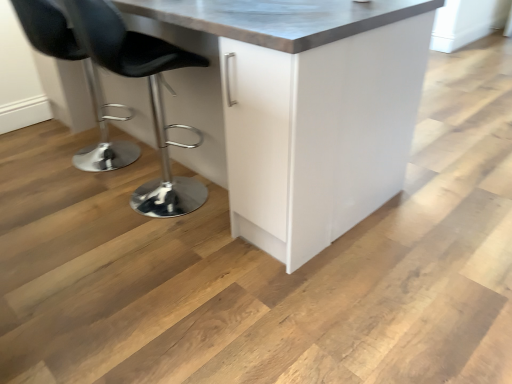
Where is `black leather stool at left, arranged as the first chair when viewed from the right`? The height and width of the screenshot is (384, 512). black leather stool at left, arranged as the first chair when viewed from the right is located at coordinates (149, 95).

This screenshot has height=384, width=512. I want to click on black leather stool at left, arranged as the first chair when viewed from the right, so click(x=149, y=95).

Can we say black leather stool at left, arranged as the first chair when viewed from the right, lies outside white glossy cabinet at center?

No, black leather stool at left, arranged as the first chair when viewed from the right, is inside or overlapping with white glossy cabinet at center.

Is black leather stool at left, arranged as the first chair when viewed from the right, looking in the opposite direction of white glossy cabinet at center?

Absolutely, black leather stool at left, arranged as the first chair when viewed from the right, is directed away from white glossy cabinet at center.

From the image's perspective, is black leather stool at left, arranged as the 2th chair when viewed from the left, positioned above or below white glossy cabinet at center?

Clearly, from the image's perspective, black leather stool at left, arranged as the 2th chair when viewed from the left, is below white glossy cabinet at center.

Image resolution: width=512 pixels, height=384 pixels. I want to click on cabinetry that appears below the black leather stool at left, arranged as the first chair when viewed from the right (from a real-world perspective), so click(x=311, y=108).

Is black leather stool at left, arranged as the first chair when viewed from the right, outside of black leather stool at left, the first chair in the left-to-right sequence?

That's correct, black leather stool at left, arranged as the first chair when viewed from the right, is outside of black leather stool at left, the first chair in the left-to-right sequence.

Can you confirm if black leather stool at left, arranged as the 2th chair when viewed from the left, is smaller than black leather stool at left, the first chair in the left-to-right sequence?

No, black leather stool at left, arranged as the 2th chair when viewed from the left, is not smaller than black leather stool at left, the first chair in the left-to-right sequence.

Relative to black leather stool at left, the first chair in the left-to-right sequence, is black leather stool at left, arranged as the first chair when viewed from the right, in front or behind?

black leather stool at left, arranged as the first chair when viewed from the right, is in front of black leather stool at left, the first chair in the left-to-right sequence.

Based on their positions, is black leather stool at left, arranged as the 2th chair when viewed from the left, located to the left or right of black leather stool at left, the second chair viewed from the right?

From the image, it's evident that black leather stool at left, arranged as the 2th chair when viewed from the left, is to the right of black leather stool at left, the second chair viewed from the right.

Between point (342, 36) and point (24, 29), which one is positioned in front?

The point (342, 36) is closer to the camera.

Which is more to the right, white glossy cabinet at center or black leather stool at left, the first chair in the left-to-right sequence?

white glossy cabinet at center.

From the image's perspective, which object appears higher, white glossy cabinet at center or black leather stool at left, the second chair viewed from the right?

From the image's view, white glossy cabinet at center is above.

Is black leather stool at left, the first chair in the left-to-right sequence, wider or thinner than black leather stool at left, arranged as the 2th chair when viewed from the left?

Clearly, black leather stool at left, the first chair in the left-to-right sequence, has less width compared to black leather stool at left, arranged as the 2th chair when viewed from the left.

Considering the relative positions of black leather stool at left, the first chair in the left-to-right sequence, and black leather stool at left, arranged as the 2th chair when viewed from the left, in the image provided, is black leather stool at left, the first chair in the left-to-right sequence, to the left or to the right of black leather stool at left, arranged as the 2th chair when viewed from the left,?

black leather stool at left, the first chair in the left-to-right sequence, is positioned on black leather stool at left, arranged as the 2th chair when viewed from the left,'s left side.

Is black leather stool at left, the second chair viewed from the right, oriented away from black leather stool at left, arranged as the first chair when viewed from the right?

No, black leather stool at left, the second chair viewed from the right,'s orientation is not away from black leather stool at left, arranged as the first chair when viewed from the right.

Between black leather stool at left, the second chair viewed from the right, and black leather stool at left, arranged as the 2th chair when viewed from the left, which one has smaller size?

With smaller size is black leather stool at left, the second chair viewed from the right.

Between white glossy cabinet at center and black leather stool at left, arranged as the 2th chair when viewed from the left, which one has larger size?

white glossy cabinet at center is bigger.

Is white glossy cabinet at center taller than black leather stool at left, arranged as the 2th chair when viewed from the left?

In fact, white glossy cabinet at center may be shorter than black leather stool at left, arranged as the 2th chair when viewed from the left.

Between point (393, 171) and point (154, 180), which one is positioned in front?

The point (393, 171) is closer.

From the image's perspective, is white glossy cabinet at center below black leather stool at left, arranged as the first chair when viewed from the right?

No.

Looking at this image, between black leather stool at left, the first chair in the left-to-right sequence, and white glossy cabinet at center, which one has smaller size?

black leather stool at left, the first chair in the left-to-right sequence.

Which is more to the left, black leather stool at left, the first chair in the left-to-right sequence, or white glossy cabinet at center?

Positioned to the left is black leather stool at left, the first chair in the left-to-right sequence.

Is black leather stool at left, the second chair viewed from the right, facing away from white glossy cabinet at center?

That's right, black leather stool at left, the second chair viewed from the right, is facing away from white glossy cabinet at center.

I want to click on chair that is the 2nd one when counting downward from the white glossy cabinet at center (from the image's perspective), so click(x=149, y=95).

I want to click on chair below the black leather stool at left, arranged as the first chair when viewed from the right (from a real-world perspective), so click(86, 78).

Based on their spatial positions, is black leather stool at left, the second chair viewed from the right, or white glossy cabinet at center further from black leather stool at left, arranged as the first chair when viewed from the right?

Among the two, black leather stool at left, the second chair viewed from the right, is located further to black leather stool at left, arranged as the first chair when viewed from the right.

From the image, which object appears to be nearer to black leather stool at left, the second chair viewed from the right, white glossy cabinet at center or black leather stool at left, arranged as the first chair when viewed from the right?

black leather stool at left, arranged as the first chair when viewed from the right, is closer to black leather stool at left, the second chair viewed from the right.

When comparing their distances from white glossy cabinet at center, does black leather stool at left, the second chair viewed from the right, or black leather stool at left, arranged as the 2th chair when viewed from the left, seem further?

Among the two, black leather stool at left, the second chair viewed from the right, is located further to white glossy cabinet at center.

From the image, which object appears to be farther from white glossy cabinet at center, black leather stool at left, arranged as the first chair when viewed from the right, or black leather stool at left, the second chair viewed from the right?

black leather stool at left, the second chair viewed from the right, is positioned further to the anchor white glossy cabinet at center.

Looking at this image, looking at the image, which one is located closer to black leather stool at left, the first chair in the left-to-right sequence, black leather stool at left, arranged as the 2th chair when viewed from the left, or white glossy cabinet at center?

black leather stool at left, arranged as the 2th chair when viewed from the left.

Which object lies nearer to the anchor point black leather stool at left, arranged as the first chair when viewed from the right, white glossy cabinet at center or black leather stool at left, the second chair viewed from the right?

white glossy cabinet at center.

Locate an element on the screen. chair positioned between white glossy cabinet at center and black leather stool at left, the second chair viewed from the right, from near to far is located at coordinates (149, 95).